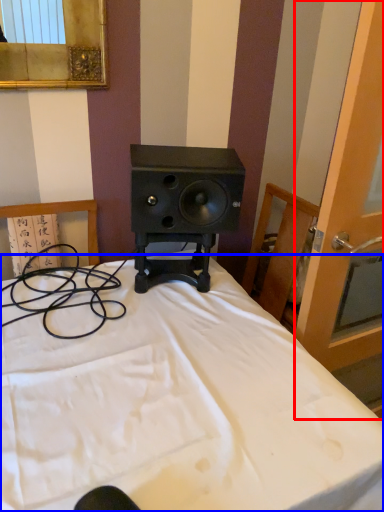
Question: Which point is further to the camera, screen door (highlighted by a red box) or bed (highlighted by a blue box)?

Choices:
 (A) screen door
 (B) bed

Answer: (A)